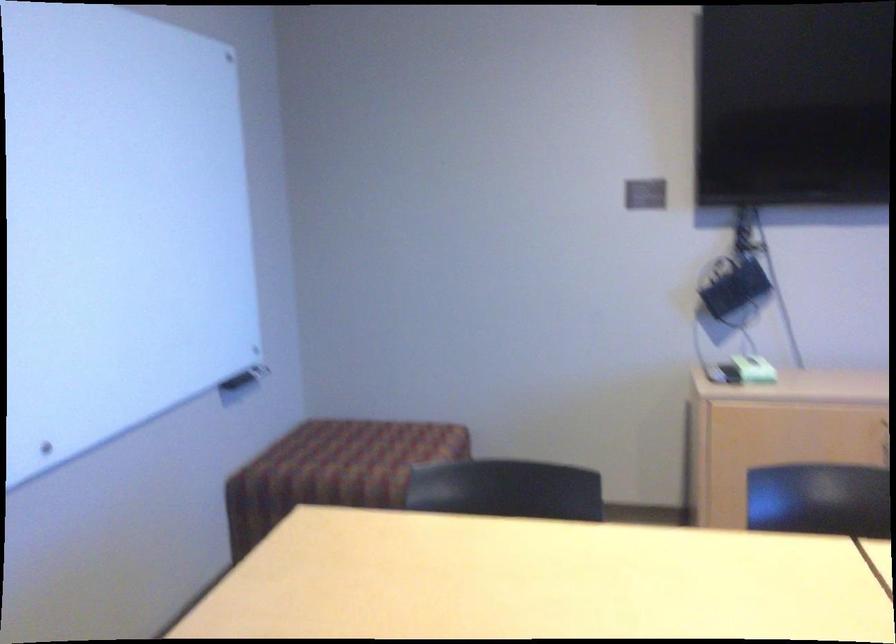
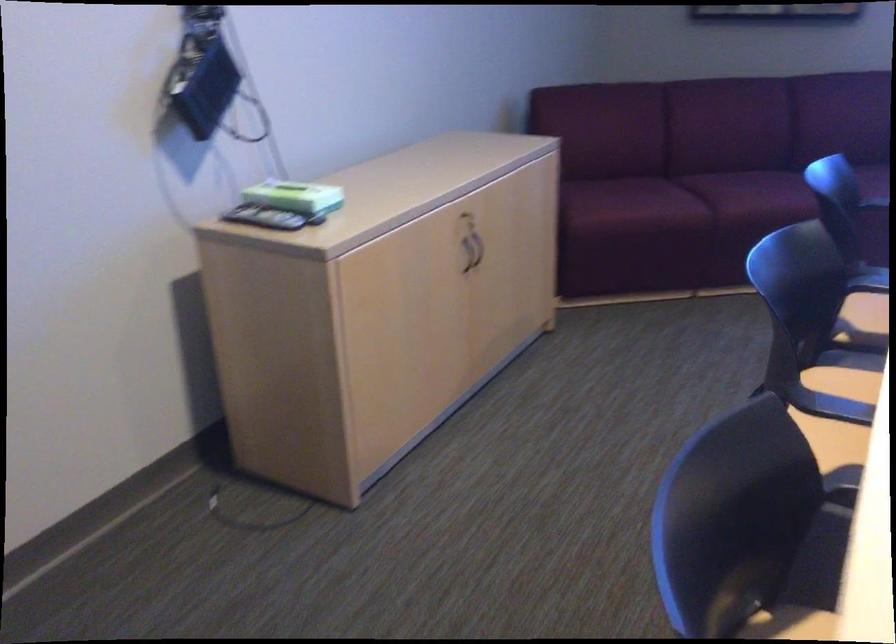
Locate, in the second image, the point that corresponds to point 707,368 in the first image.

(263, 218)